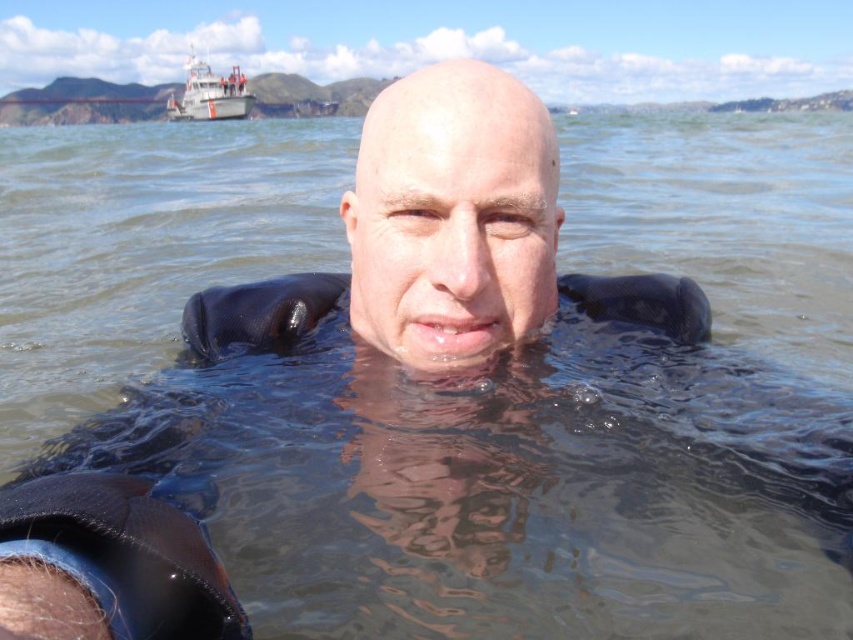
Question: Is the position of matte black head at center more distant than that of white matte boat at upper left?

Choices:
 (A) no
 (B) yes

Answer: (A)

Question: Is matte black head at center below white matte boat at upper left?

Choices:
 (A) yes
 (B) no

Answer: (A)

Question: Which object appears closest to the camera in this image?

Choices:
 (A) white matte boat at upper left
 (B) matte black head at center

Answer: (B)

Question: Can you confirm if matte black head at center is positioned to the right of white matte boat at upper left?

Choices:
 (A) yes
 (B) no

Answer: (A)

Question: Which object appears closest to the camera in this image?

Choices:
 (A) white matte boat at upper left
 (B) matte black head at center

Answer: (B)